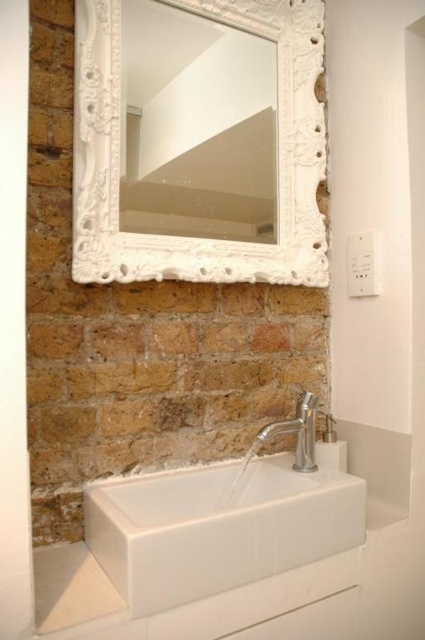
Question: Is white glossy sink at center positioned in front of silver metallic faucet at lower center?

Choices:
 (A) yes
 (B) no

Answer: (A)

Question: Which point is farther from the camera taking this photo?

Choices:
 (A) [334, 518]
 (B) [282, 426]
 (C) [187, 244]

Answer: (C)

Question: Is white glossy sink at center to the left of silver metallic faucet at lower center from the viewer's perspective?

Choices:
 (A) no
 (B) yes

Answer: (B)

Question: Estimate the real-world distances between objects in this image. Which object is farther from the silver metallic faucet at lower center?

Choices:
 (A) white glossy sink at center
 (B) white carved mirror at upper center

Answer: (B)

Question: Can you confirm if white glossy sink at center is wider than silver metallic faucet at lower center?

Choices:
 (A) no
 (B) yes

Answer: (B)

Question: Considering the real-world distances, which object is farthest from the white glossy sink at center?

Choices:
 (A) white carved mirror at upper center
 (B) silver metallic faucet at lower center

Answer: (A)